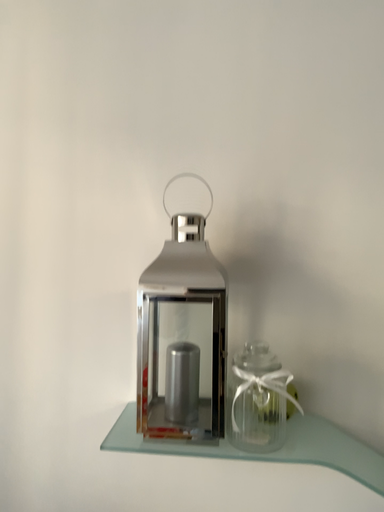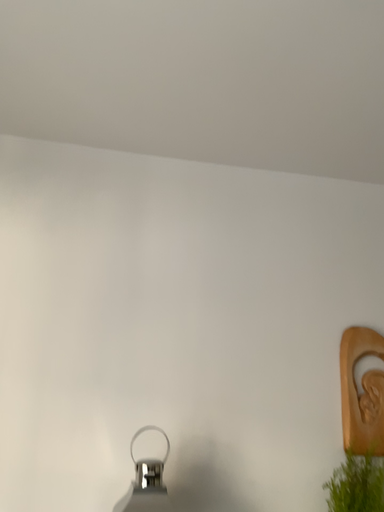
Question: Which way did the camera rotate in the video?

Choices:
 (A) rotated left
 (B) rotated right

Answer: (B)